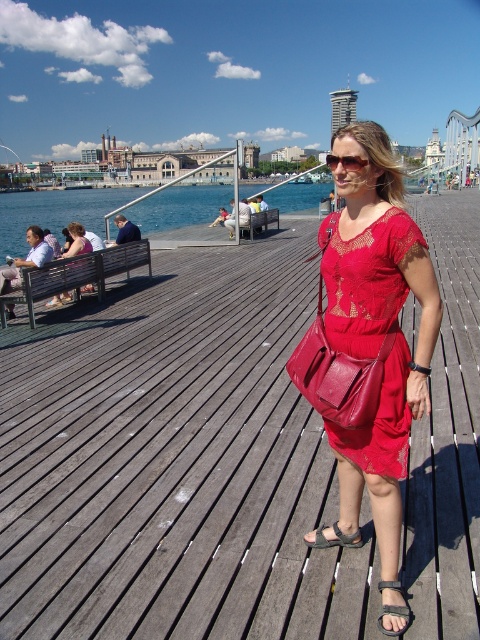
Question: Does red leather dress at center appear on the right side of red lace dress at center?

Choices:
 (A) yes
 (B) no

Answer: (A)

Question: From the image, what is the correct spatial relationship of blue water at left in relation to matte black dress at center?

Choices:
 (A) left
 (B) right

Answer: (A)

Question: Among these objects, which one is nearest to the camera?

Choices:
 (A) leather at center
 (B) black leather sandal at lower center

Answer: (B)

Question: Is red lace dress at center positioned at the back of brown leather sandal at lower center?

Choices:
 (A) no
 (B) yes

Answer: (B)

Question: Estimate the real-world distances between objects in this image. Which object is closer to the red lace dress at center?

Choices:
 (A) red leather dress at center
 (B) black leather sandal at lower center
 (C) matte black shirt at left

Answer: (A)

Question: Which is nearer to the red leather dress at center?

Choices:
 (A) wooden planks at center
 (B) black leather sandal at lower center
 (C) matte black dress at center

Answer: (B)